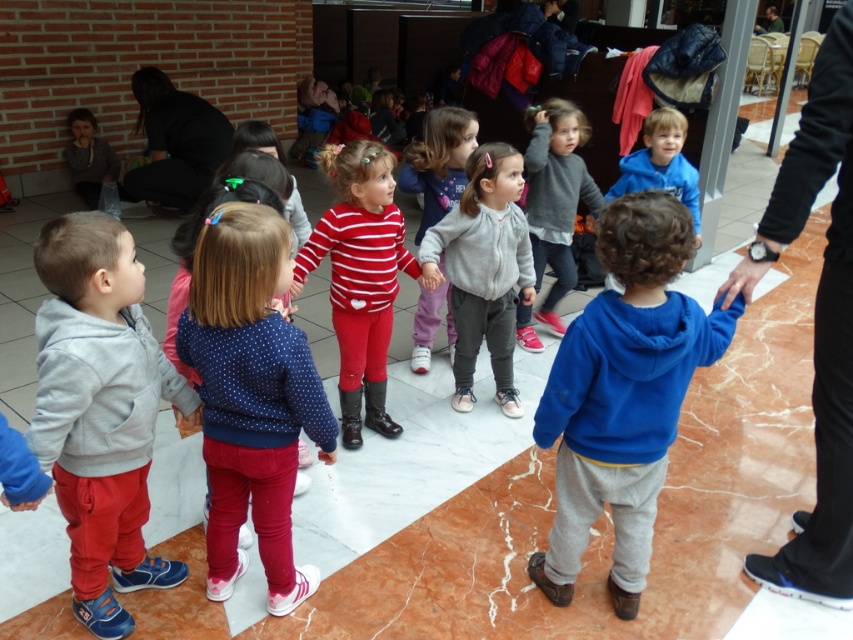
You are a photographer trying to capture a photo of both the blue fleece sweatshirt at center and the blue dotted sweater at center. Since they are both at center, can you tell me which one is positioned more to the right?

The blue fleece sweatshirt at center is positioned to the right of the blue dotted sweater at center, so the blue fleece sweatshirt at center is more to the right.

You are standing in the room and want to reach both the point at coordinates point (144, 328) and the point at coordinates point (352, 316). Which point will you reach first if you move towards them?

You will reach point (144, 328) first because it is closer to you than point (352, 316).